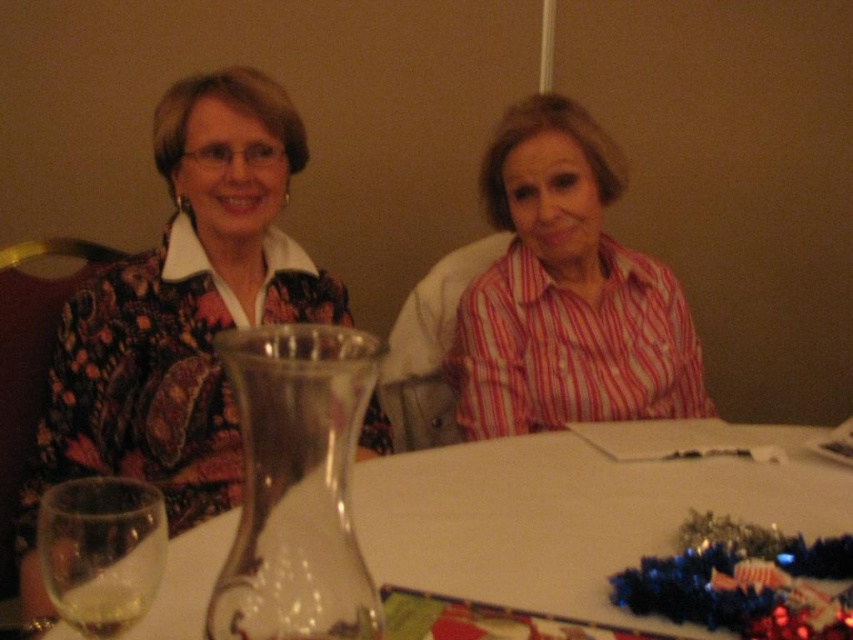
You are a server at a restaurant and need to place a new drink order on the table. The table has the clear glass carafe at center and the clear glass wine glass at lower left. What is the minimum distance you should maintain between the new drink and the existing items to ensure it doesn

The minimum distance you should maintain between the new drink and the existing items is 19.47 inches, as the current distance between the clear glass carafe at center and the clear glass wine glass at lower left is exactly that measurement.

You are a server at a dinner party and need to place a new drink order on the table. The carafe needs to be placed to the right of the wine glass. Is the current arrangement of the clear glass carafe at center and clear glass wine glass at lower left suitable for the new order?

The clear glass carafe at center is already positioned on the right side of the clear glass wine glass at lower left, so the current arrangement meets the requirement of placing the carafe to the right of the wine glass.

You are standing in front of the table where two people are sitting. You want to place a small gift between the two points marked as point [178,269] and point [128,620]. Which point should you move towards to ensure the gift is placed closer to the person on the right?

To place the gift closer to the person on the right, you should move towards point [128,620] since it is in front of point [178,269], making it closer to the person on the right.